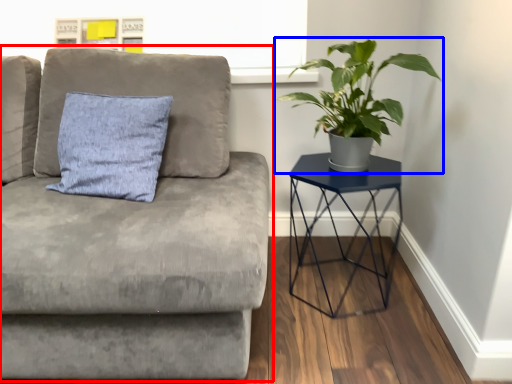
Question: Which object appears farthest to the camera in this image, studio couch (highlighted by a red box) or houseplant (highlighted by a blue box)?

Choices:
 (A) studio couch
 (B) houseplant

Answer: (B)